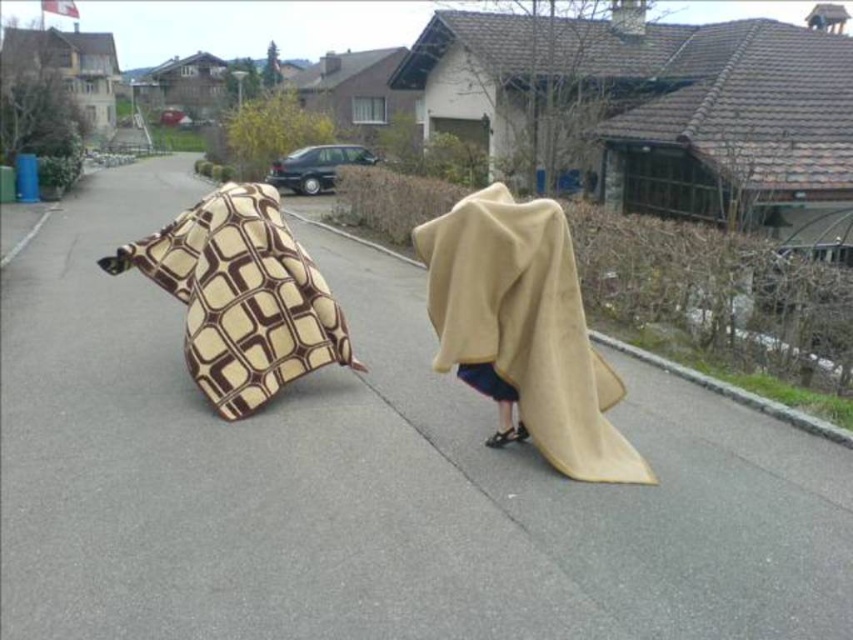
You are a delivery person trying to reach the house on the right side of the road. There are two blankets in your path. Which blanket should you step over first, the beige fleece blanket at center or the brown and beige patterned blanket at left?

You should step over the brown and beige patterned blanket at left first because the beige fleece blanket at center is positioned under it, meaning the brown and beige patterned blanket at left is on top and closer to your path.

You are a delivery person trying to cross the road in the image. There are two blankets on either side of the road. The beige fleece blanket at center and the brown and beige patterned blanket at left. Which blanket is wider so you can step over it more easily?

The brown and beige patterned blanket at left is wider than the beige fleece blanket at center, so you can step over it more easily.

You are a delivery person trying to navigate through the suburban street. You see a beige fleece blanket at center and a brown and beige patterned blanket at left. Which blanket is taller?

The beige fleece blanket at center is taller than the brown and beige patterned blanket at left.